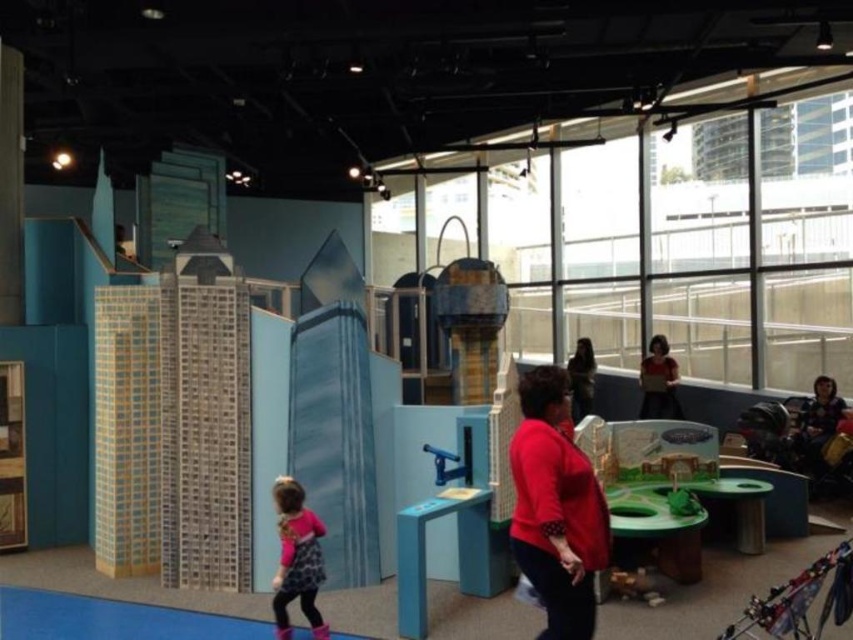
Question: Which point appears farthest from the camera in this image?

Choices:
 (A) (659, 406)
 (B) (450, 476)
 (C) (283, 616)

Answer: (A)

Question: Can you confirm if pink fabric dress at lower left is thinner than blue plastic lever at center?

Choices:
 (A) yes
 (B) no

Answer: (B)

Question: Which point is farther to the camera?

Choices:
 (A) matte red sweater at center
 (B) dark brown hair at center

Answer: (B)

Question: Where is matte red sweater at center located in relation to blue plastic lever at center in the image?

Choices:
 (A) right
 (B) left

Answer: (A)

Question: Which object is farther from the camera taking this photo?

Choices:
 (A) matte red sweater at center
 (B) matte red shirt at upper right

Answer: (B)

Question: From the image, what is the correct spatial relationship of matte red shirt at upper right in relation to blue plastic lever at center?

Choices:
 (A) right
 (B) left

Answer: (A)